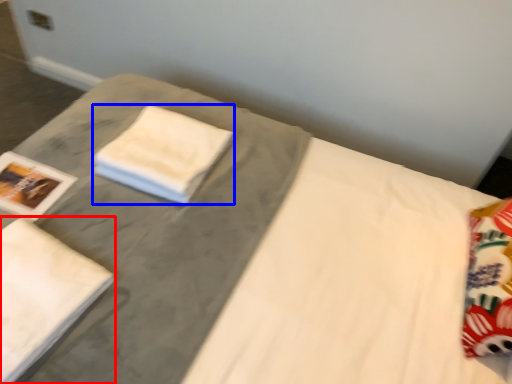
Question: Which of the following is the farthest to the observer, bath towel (highlighted by a red box) or cloth (highlighted by a blue box)?

Choices:
 (A) bath towel
 (B) cloth

Answer: (B)